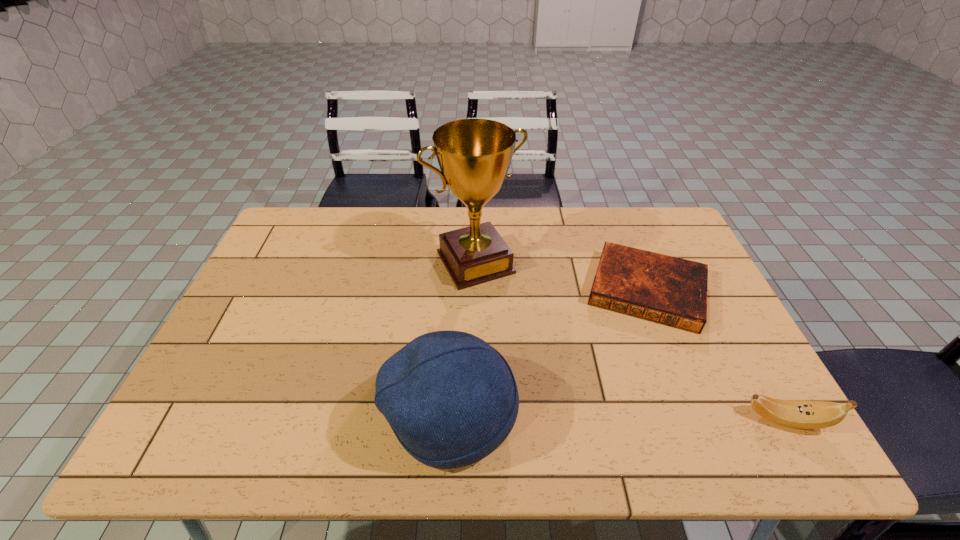
Where is `free space located 0.140m on the plaque of the award`? The width and height of the screenshot is (960, 540). free space located 0.140m on the plaque of the award is located at coordinates (514, 321).

Identify the location of free space located on the plaque of the award. The image size is (960, 540). (522, 334).

Locate an element on the screen. object present at the far edge is located at coordinates (474, 155).

Identify the location of skullcap that is positioned at the near edge. (451, 399).

The width and height of the screenshot is (960, 540). Find the location of `banana that is at the near edge`. banana that is at the near edge is located at coordinates (798, 414).

Identify the location of banana that is at the right edge. This screenshot has width=960, height=540. click(x=798, y=414).

The width and height of the screenshot is (960, 540). What are the coordinates of `Bible situated at the right edge` in the screenshot? It's located at (668, 290).

Find the location of a particular element. object that is at the near right corner is located at coordinates (798, 414).

Image resolution: width=960 pixels, height=540 pixels. What are the coordinates of `vacant space at the far edge of the desktop` in the screenshot? It's located at (395, 236).

Image resolution: width=960 pixels, height=540 pixels. I want to click on free space at the near edge of the desktop, so click(x=371, y=412).